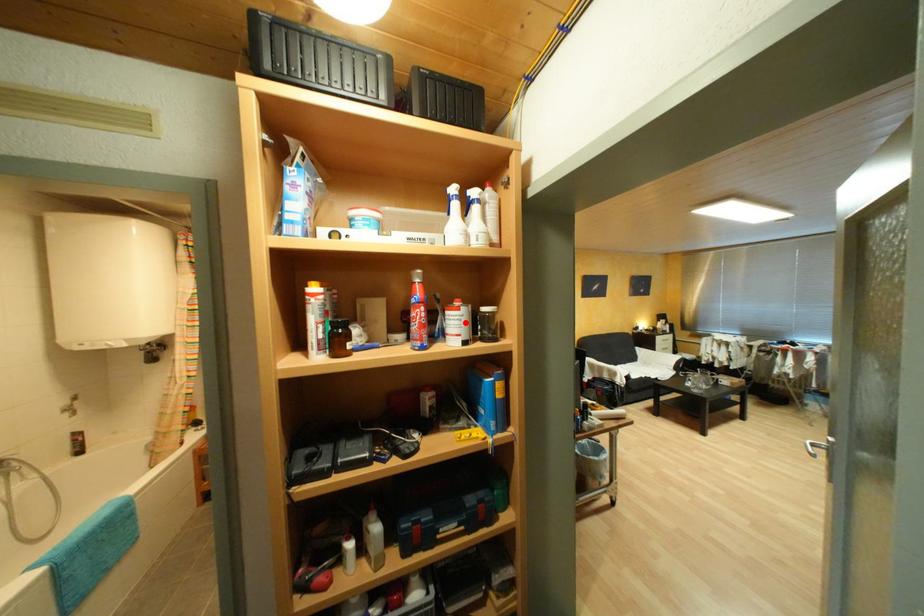
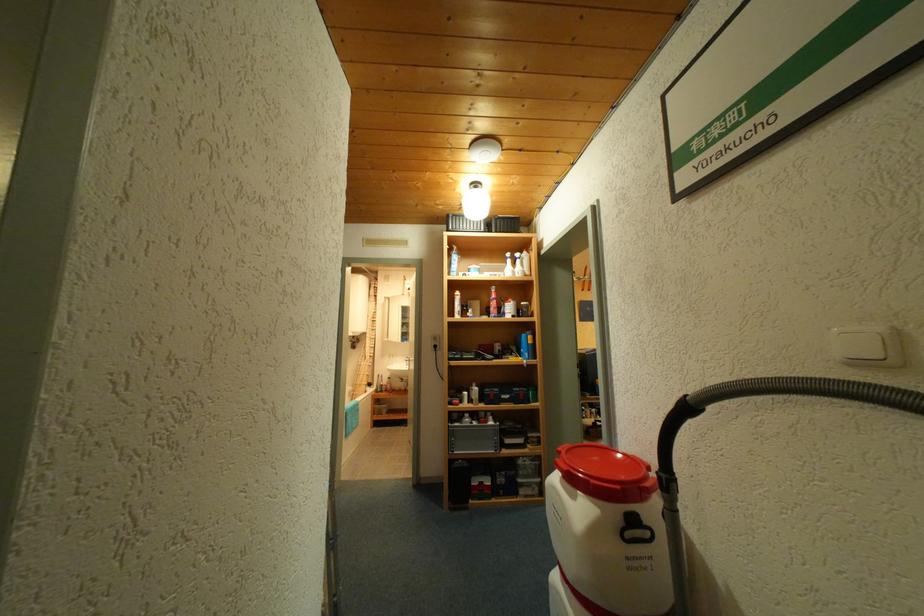
In the second image, find the point that corresponds to the highlighted location in the first image.

(518, 309)